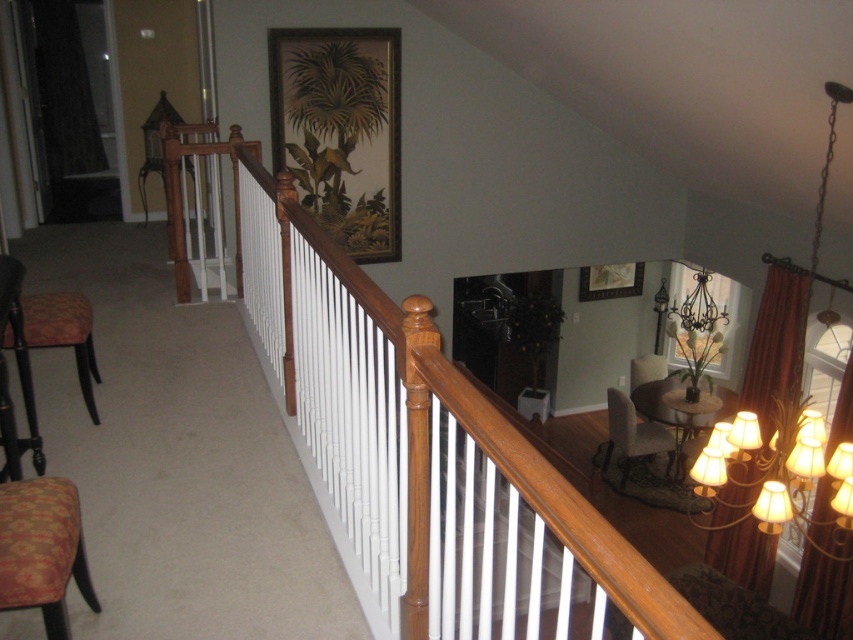
Question: Does warm fabric chandelier at upper right come behind patterned fabric armchair at lower left?

Choices:
 (A) yes
 (B) no

Answer: (A)

Question: Which point is closer to the camera?

Choices:
 (A) (294, 257)
 (B) (90, 317)

Answer: (A)

Question: Can you confirm if patterned fabric armchair at lower left is smaller than velvet beige armchair at lower right?

Choices:
 (A) yes
 (B) no

Answer: (A)

Question: Which of the following is the farthest from the observer?

Choices:
 (A) (608, 412)
 (B) (758, 508)
 (C) (62, 524)

Answer: (A)

Question: Which point appears closest to the camera in this image?

Choices:
 (A) (6, 333)
 (B) (51, 476)
 (C) (300, 381)

Answer: (B)

Question: Can you confirm if warm fabric chandelier at upper right is positioned to the right of patterned fabric armchair at lower left?

Choices:
 (A) no
 (B) yes

Answer: (B)